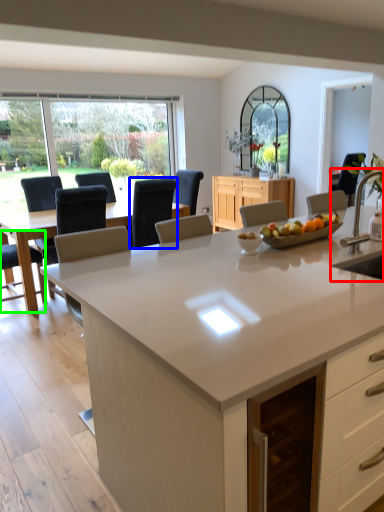
Question: Which is farther away from sink (highlighted by a red box)? chair (highlighted by a blue box) or chair (highlighted by a green box)?

Choices:
 (A) chair
 (B) chair

Answer: (B)